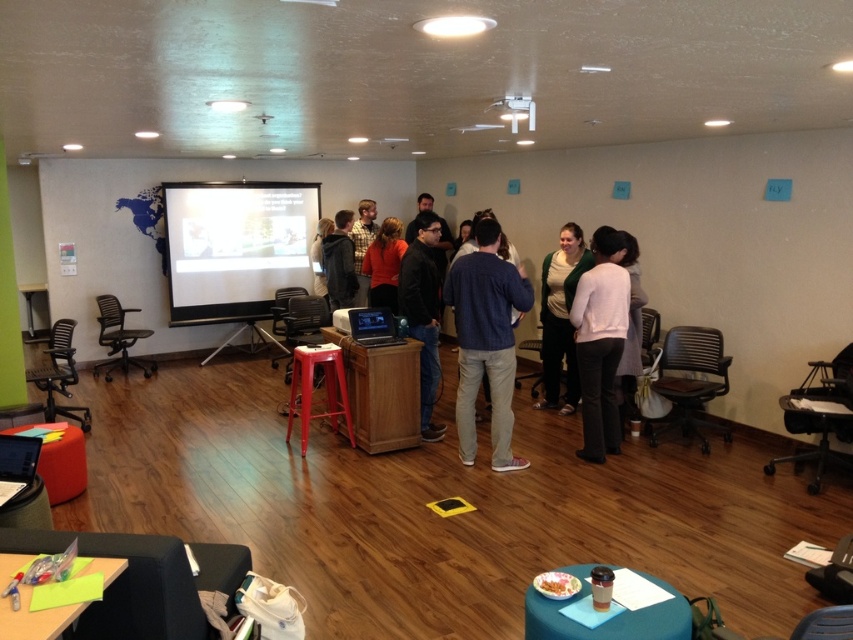
Question: Which point is farther to the camera?

Choices:
 (A) blue denim jeans at center
 (B) metallic red stool at center

Answer: (B)

Question: Can you confirm if matte white projector screen at center is positioned to the left of matte black hoodie at center?

Choices:
 (A) yes
 (B) no

Answer: (A)

Question: Is knit sweater at center thinner than white sweater at center?

Choices:
 (A) yes
 (B) no

Answer: (B)

Question: Considering the real-world distances, which object is closest to the matte green sweater at center?

Choices:
 (A) white sweater at center
 (B) knit sweater at center
 (C) metallic red stool at center

Answer: (A)

Question: Does blue denim jeans at center have a larger size compared to knit sweater at center?

Choices:
 (A) yes
 (B) no

Answer: (B)

Question: Which point appears closest to the camera in this image?

Choices:
 (A) (502, 380)
 (B) (361, 273)

Answer: (A)